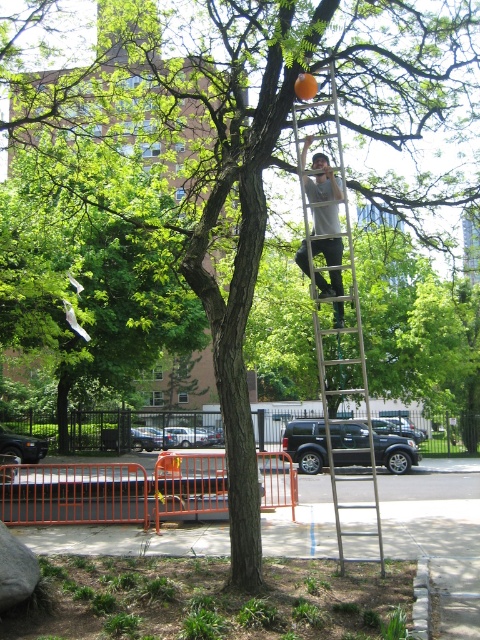
Question: Can you confirm if silver metallic ladder at center is bigger than gray cotton shirt at upper center?

Choices:
 (A) yes
 (B) no

Answer: (A)

Question: Is silver metallic ladder at center to the left of gray cotton shirt at upper center from the viewer's perspective?

Choices:
 (A) no
 (B) yes

Answer: (A)

Question: Can you confirm if silver metallic ladder at center is positioned to the right of gray cotton shirt at upper center?

Choices:
 (A) yes
 (B) no

Answer: (A)

Question: Which object appears closest to the camera in this image?

Choices:
 (A) silver metallic ladder at center
 (B) gray cotton shirt at upper center

Answer: (A)